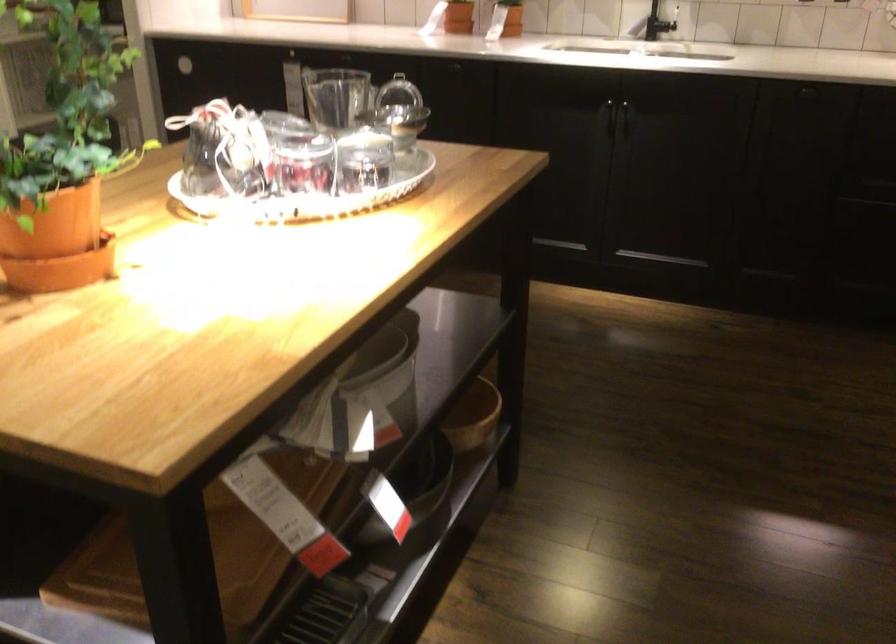
This screenshot has height=644, width=896. Describe the element at coordinates (472, 415) in the screenshot. I see `a wooden bowl` at that location.